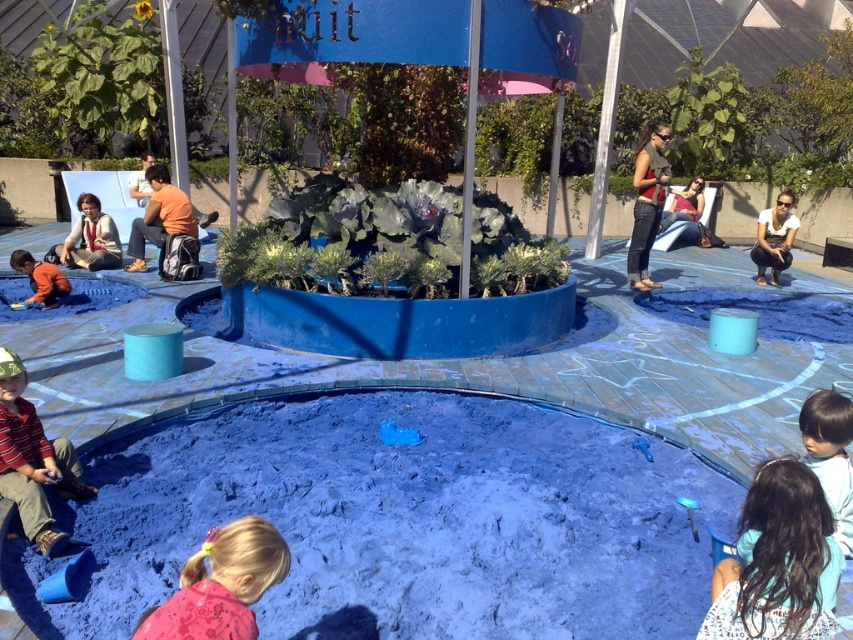
Between dark brown hair at lower right and striped cotton shirt at lower left, which one is positioned higher?

striped cotton shirt at lower left is above.

Is dark brown hair at lower right bigger than striped cotton shirt at lower left?

Incorrect, dark brown hair at lower right is not larger than striped cotton shirt at lower left.

What do you see at coordinates (778, 561) in the screenshot? I see `dark brown hair at lower right` at bounding box center [778, 561].

The width and height of the screenshot is (853, 640). Identify the location of dark brown hair at lower right. (778, 561).

Does striped cotton shirt at lower left have a greater height compared to matte orange shirt at lower left?

Yes.

In the scene shown: Who is positioned more to the right, striped cotton shirt at lower left or matte orange shirt at lower left?

From the viewer's perspective, striped cotton shirt at lower left appears more on the right side.

Which is behind, point (24, 474) or point (33, 268)?

The point (33, 268) is more distant.

The height and width of the screenshot is (640, 853). Identify the location of striped cotton shirt at lower left. (33, 460).

Can you confirm if dark brown hair at lower right is shorter than pink fabric at lower center?

No.

Who is taller, dark brown hair at lower right or pink fabric at lower center?

Standing taller between the two is dark brown hair at lower right.

Find the location of a particular element. The image size is (853, 640). dark brown hair at lower right is located at coordinates (778, 561).